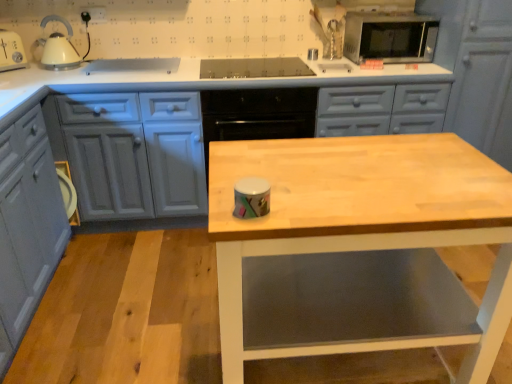
Question: Is matte gray cabinet at upper right, placed as the 1th cabinetry when sorted from right to left, to the left of matte gray cabinets at center, the second cabinetry when ordered from right to left, from the viewer's perspective?

Choices:
 (A) no
 (B) yes

Answer: (A)

Question: Is matte gray cabinets at center, the second cabinetry when ordered from right to left, at the back of matte gray cabinet at upper right, which appears as the 3th cabinetry when viewed from the left?

Choices:
 (A) no
 (B) yes

Answer: (A)

Question: Is matte gray cabinet at upper right, which appears as the 3th cabinetry when viewed from the left, at the right side of matte gray cabinets at center, the second cabinetry when ordered from right to left?

Choices:
 (A) yes
 (B) no

Answer: (A)

Question: Considering the relative sizes of matte gray cabinet at upper right, which appears as the 3th cabinetry when viewed from the left, and matte gray cabinets at center, the second cabinetry when ordered from left to right, in the image provided, is matte gray cabinet at upper right, which appears as the 3th cabinetry when viewed from the left, taller than matte gray cabinets at center, the second cabinetry when ordered from left to right,?

Choices:
 (A) no
 (B) yes

Answer: (B)

Question: Is matte gray cabinet at upper right, which appears as the 3th cabinetry when viewed from the left, bigger than matte gray cabinets at center, the second cabinetry when ordered from right to left?

Choices:
 (A) yes
 (B) no

Answer: (B)

Question: Is matte gray cabinet at upper right, placed as the 1th cabinetry when sorted from right to left, smaller than matte gray cabinets at center, the second cabinetry when ordered from left to right?

Choices:
 (A) no
 (B) yes

Answer: (B)

Question: Is matte gray cabinet at lower left, the third cabinetry viewed from the right, oriented away from wooden table at center?

Choices:
 (A) no
 (B) yes

Answer: (A)

Question: From a real-world perspective, is matte gray cabinet at lower left, the third cabinetry viewed from the right, positioned under wooden table at center based on gravity?

Choices:
 (A) yes
 (B) no

Answer: (A)

Question: Is matte gray cabinet at lower left, the 1th cabinetry from the left, wider than wooden table at center?

Choices:
 (A) yes
 (B) no

Answer: (B)

Question: From the image's perspective, is matte gray cabinet at lower left, the 1th cabinetry from the left, located above wooden table at center?

Choices:
 (A) no
 (B) yes

Answer: (B)

Question: From a real-world perspective, is matte gray cabinet at lower left, the third cabinetry viewed from the right, on top of wooden table at center?

Choices:
 (A) no
 (B) yes

Answer: (A)

Question: Can you confirm if matte gray cabinet at lower left, the 1th cabinetry from the left, is thinner than wooden table at center?

Choices:
 (A) no
 (B) yes

Answer: (B)

Question: From the image's perspective, is matte gray cabinet at upper right, which appears as the 3th cabinetry when viewed from the left, over wooden table at center?

Choices:
 (A) no
 (B) yes

Answer: (B)